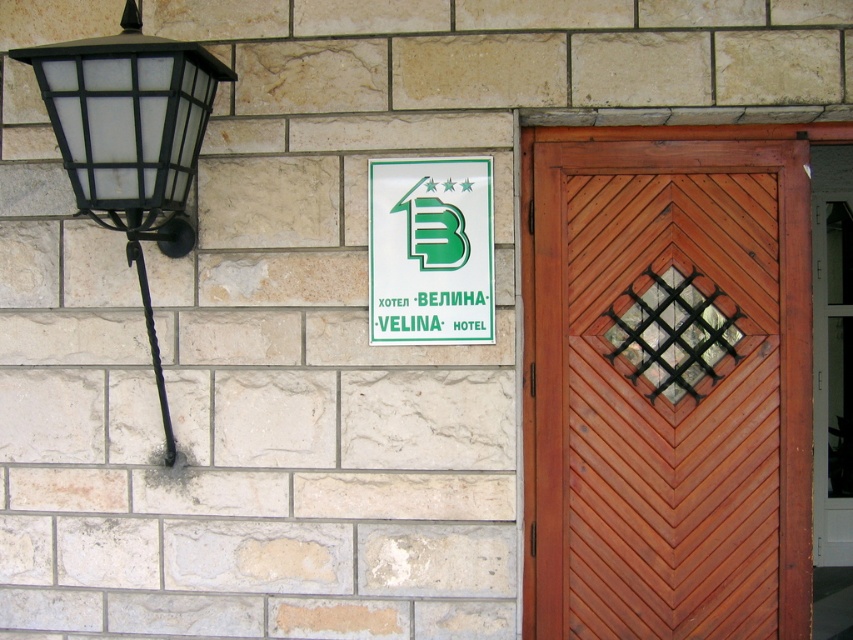
Question: Among these objects, which one is farthest from the camera?

Choices:
 (A) mahogany wood door at right
 (B) white plastic sign at upper center
 (C) matte glass wall lamp at left

Answer: (A)

Question: Which object is farther from the camera taking this photo?

Choices:
 (A) mahogany wood door at right
 (B) matte glass wall lamp at left

Answer: (A)

Question: Is matte glass wall lamp at left smaller than white plastic sign at upper center?

Choices:
 (A) no
 (B) yes

Answer: (A)

Question: Based on their relative distances, which object is farther from the matte glass wall lamp at left?

Choices:
 (A) mahogany wood door at right
 (B) white plastic sign at upper center

Answer: (A)

Question: Considering the relative positions of mahogany wood door at right and matte glass wall lamp at left in the image provided, where is mahogany wood door at right located with respect to matte glass wall lamp at left?

Choices:
 (A) right
 (B) left

Answer: (A)

Question: Does mahogany wood door at right appear on the left side of matte glass wall lamp at left?

Choices:
 (A) yes
 (B) no

Answer: (B)